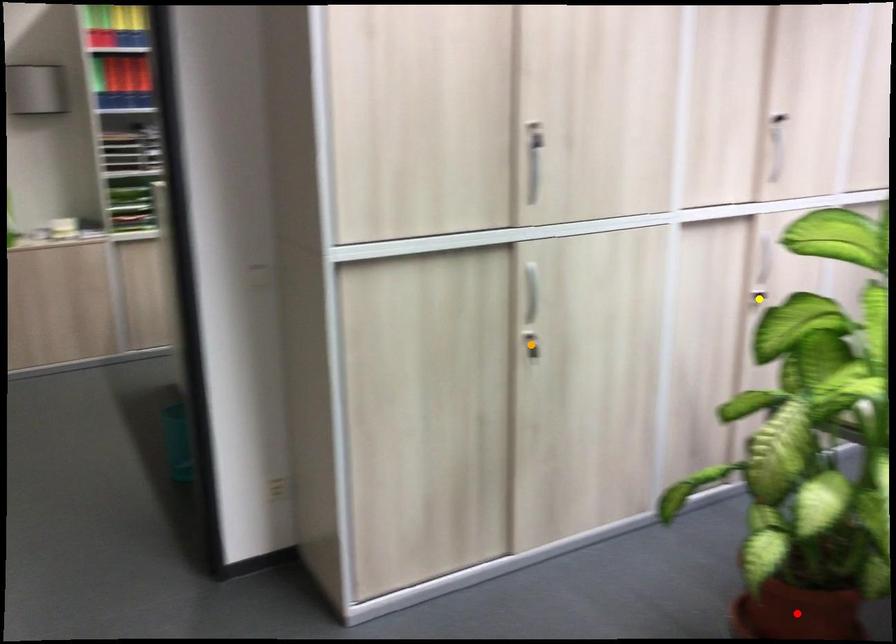
Order these from nearest to farthest:
- yellow point
- red point
- orange point

red point < orange point < yellow point